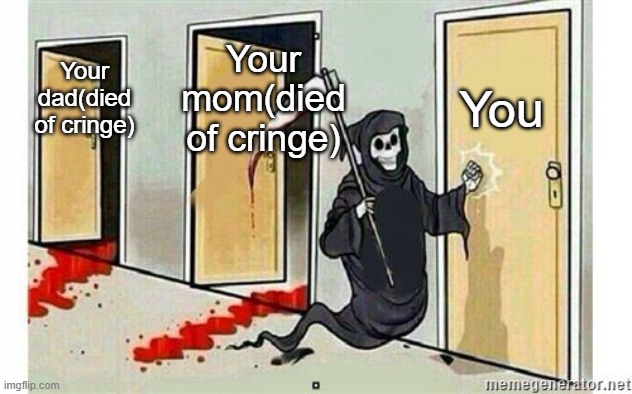
The width and height of the screenshot is (632, 394). What are the coordinates of `open doors` in the screenshot? It's located at (222, 229), (71, 176).